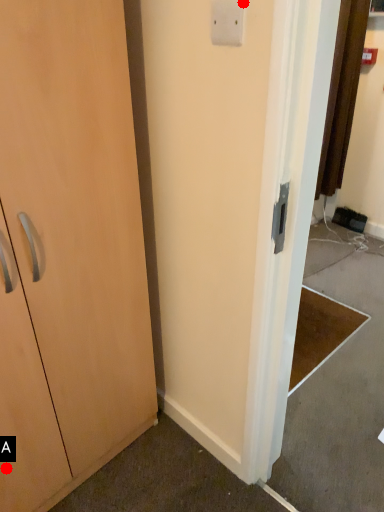
Question: Two points are circled on the image, labeled by A and B beside each circle. Which of the following is the closest to the observer?

Choices:
 (A) A is closer
 (B) B is closer

Answer: (B)